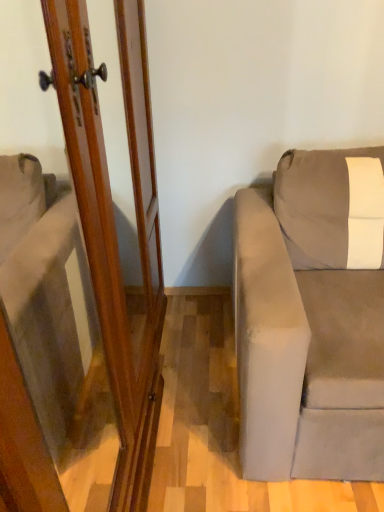
What do you see at coordinates (312, 318) in the screenshot?
I see `gray suede couch at right` at bounding box center [312, 318].

Identify the location of gray suede couch at right. (312, 318).

The image size is (384, 512). Describe the element at coordinates (115, 226) in the screenshot. I see `wooden screen door at left` at that location.

The image size is (384, 512). I want to click on wooden screen door at left, so click(115, 226).

The image size is (384, 512). Identify the location of gray suede couch at right. click(312, 318).

Which object is positioned more to the right, gray suede couch at right or wooden screen door at left?

gray suede couch at right.

Considering the positions of objects gray suede couch at right and wooden screen door at left in the image provided, who is in front, gray suede couch at right or wooden screen door at left?

wooden screen door at left is more forward.

Is point (256, 251) behind point (140, 41)?

That is False.

Based on the photo, from the image's perspective, is gray suede couch at right below wooden screen door at left?

Yes, from the image's perspective, gray suede couch at right is beneath wooden screen door at left.

From a real-world perspective, between gray suede couch at right and wooden screen door at left, who is vertically higher?

From a 3D spatial view, wooden screen door at left is above.

Considering the sizes of objects gray suede couch at right and wooden screen door at left in the image provided, who is wider, gray suede couch at right or wooden screen door at left?

With larger width is gray suede couch at right.

Is gray suede couch at right taller or shorter than wooden screen door at left?

Considering their sizes, gray suede couch at right has less height than wooden screen door at left.

From the picture: Considering the sizes of objects gray suede couch at right and wooden screen door at left in the image provided, who is smaller, gray suede couch at right or wooden screen door at left?

With smaller size is gray suede couch at right.

Would you say gray suede couch at right is inside or outside wooden screen door at left?

gray suede couch at right is not enclosed by wooden screen door at left.

Is there a large distance between gray suede couch at right and wooden screen door at left?

Actually, gray suede couch at right and wooden screen door at left are a little close together.

Is gray suede couch at right looking in the opposite direction of wooden screen door at left?

That's not correct — gray suede couch at right is not looking away from wooden screen door at left.

How many degrees apart are the facing directions of gray suede couch at right and wooden screen door at left?

89.7 degrees separate the facing orientations of gray suede couch at right and wooden screen door at left.

Identify the location of screen door above the gray suede couch at right (from the image's perspective). The image size is (384, 512). (115, 226).

Considering the relative positions of wooden screen door at left and gray suede couch at right in the image provided, is wooden screen door at left to the right of gray suede couch at right from the viewer's perspective?

Incorrect, wooden screen door at left is not on the right side of gray suede couch at right.

Is wooden screen door at left closer to camera compared to gray suede couch at right?

Yes, it is.

Is point (119, 402) closer to camera compared to point (332, 343)?

Yes, point (119, 402) is in front of point (332, 343).

From the image's perspective, is wooden screen door at left below gray suede couch at right?

No.

From a real-world perspective, who is located higher, wooden screen door at left or gray suede couch at right?

In real-world perspective, wooden screen door at left is above.

Is wooden screen door at left wider than gray suede couch at right?

In fact, wooden screen door at left might be narrower than gray suede couch at right.

Considering the relative sizes of wooden screen door at left and gray suede couch at right in the image provided, is wooden screen door at left taller than gray suede couch at right?

Yes.

In terms of size, does wooden screen door at left appear bigger or smaller than gray suede couch at right?

Clearly, wooden screen door at left is larger in size than gray suede couch at right.

Is gray suede couch at right surrounded by wooden screen door at left?

No.

Would you say wooden screen door at left is a long distance from gray suede couch at right?

No, wooden screen door at left is not far away from gray suede couch at right.

Is wooden screen door at left facing towards gray suede couch at right?

Yes.

Find the location of a particular element. studio couch below the wooden screen door at left (from the image's perspective) is located at coordinates (312, 318).

In the image, there is a wooden screen door at left. Where is `studio couch below it (from the image's perspective)`? studio couch below it (from the image's perspective) is located at coordinates (312, 318).

This screenshot has height=512, width=384. In order to click on screen door on the left of gray suede couch at right in this screenshot , I will do `click(115, 226)`.